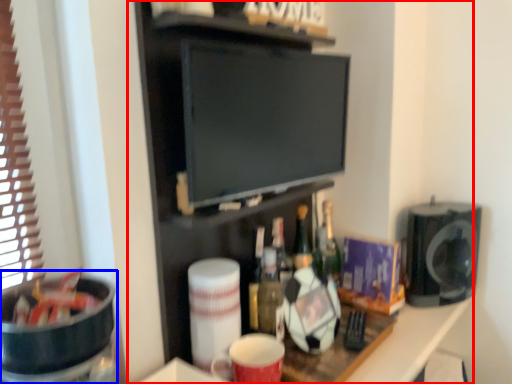
Question: Which object appears farthest to the camera in this image, entertainment center (highlighted by a red box) or appliance (highlighted by a blue box)?

Choices:
 (A) entertainment center
 (B) appliance

Answer: (A)